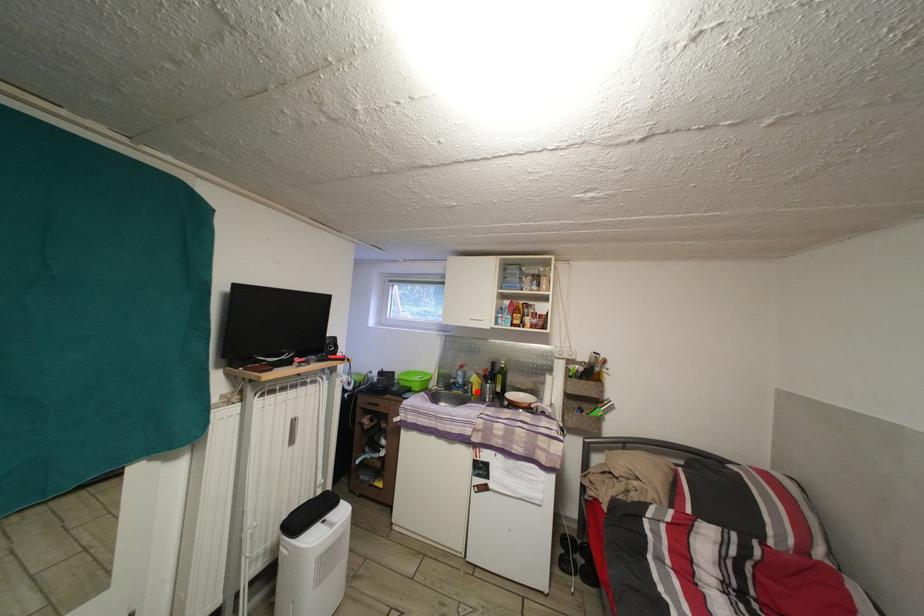
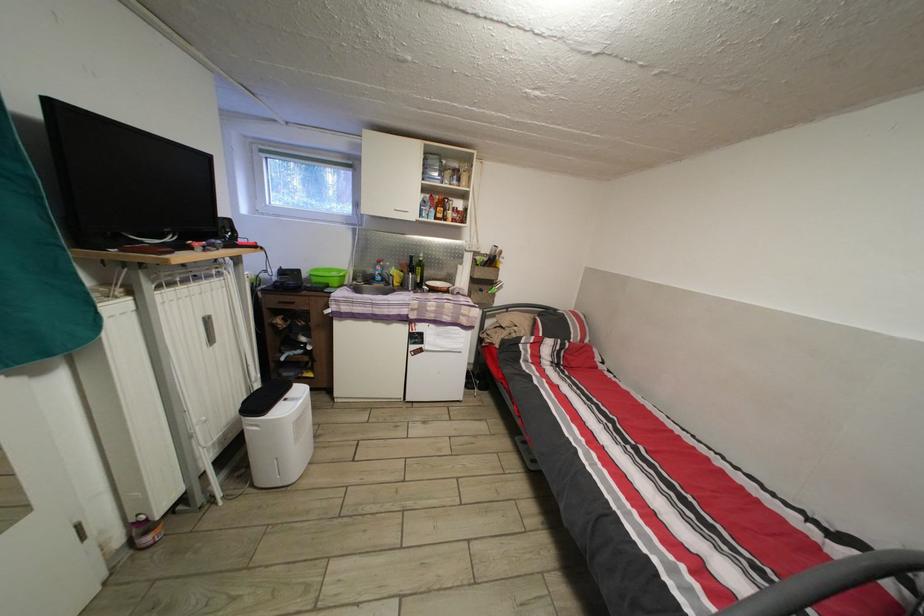
Question: I am providing you with two images of the same scene from different viewpoints. A red point is shown in image1. For the corresponding object point in image2, is it positioned nearer or farther from the camera?

Choices:
 (A) Nearer
 (B) Farther

Answer: (A)